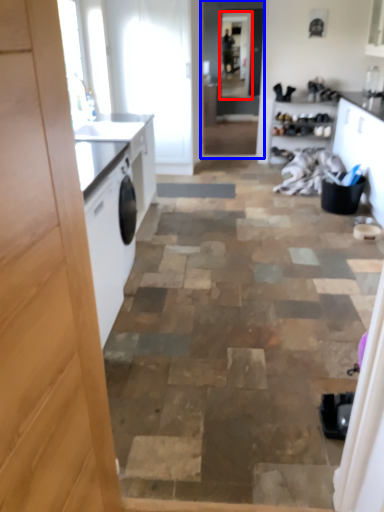
Question: Which of the following is the closest to the observer, screen door (highlighted by a red box) or screen door (highlighted by a blue box)?

Choices:
 (A) screen door
 (B) screen door

Answer: (B)